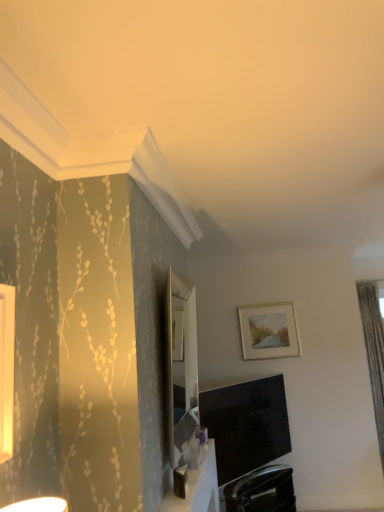
What do you see at coordinates (269, 331) in the screenshot?
I see `matte white picture frame at upper right` at bounding box center [269, 331].

This screenshot has height=512, width=384. What do you see at coordinates (246, 425) in the screenshot? I see `matte black tv at lower center` at bounding box center [246, 425].

Measure the distance between point (193, 360) and camera.

Point (193, 360) is 3.07 meters from camera.

Where is `gray textured curtain at right`? This screenshot has height=512, width=384. gray textured curtain at right is located at coordinates click(374, 352).

In the scene shown: Measure the distance between point (368,306) and camera.

Point (368,306) and camera are 4.21 meters apart.

This screenshot has width=384, height=512. Identify the location of black leather swivel chair at lower center. (262, 490).

Which object is more forward, black leather swivel chair at lower center or matte black tv at lower center?

black leather swivel chair at lower center is closer to the camera.

Can you confirm if black leather swivel chair at lower center is positioned to the right of matte black tv at lower center?

Yes.

From the image's perspective, between black leather swivel chair at lower center and matte black tv at lower center, which one is located above?

matte black tv at lower center appears higher in the image.

Would you consider matte black tv at lower center to be distant from black leather swivel chair at lower center?

Actually, matte black tv at lower center and black leather swivel chair at lower center are a little close together.

Would you say matte black tv at lower center is inside or outside black leather swivel chair at lower center?

matte black tv at lower center is spatially situated outside black leather swivel chair at lower center.

Considering the sizes of objects matte black tv at lower center and black leather swivel chair at lower center in the image provided, who is smaller, matte black tv at lower center or black leather swivel chair at lower center?

Smaller between the two is black leather swivel chair at lower center.

Between point (233, 473) and point (281, 507), which one is positioned in front?

Point (233, 473)

Which of these two, silver metallic mirror at center or gray textured curtain at right, stands shorter?

With less height is silver metallic mirror at center.

From a real-world perspective, relative to gray textured curtain at right, is silver metallic mirror at center vertically above or below?

From a real-world perspective, silver metallic mirror at center is physically above gray textured curtain at right.

What's the angular difference between silver metallic mirror at center and gray textured curtain at right's facing directions?

There is a 89.4-degree angle between the facing directions of silver metallic mirror at center and gray textured curtain at right.

Is silver metallic mirror at center closer to the viewer compared to gray textured curtain at right?

Yes, it is in front of gray textured curtain at right.

From a real-world perspective, is gray textured curtain at right located higher than black leather swivel chair at lower center?

Yes, from a real-world perspective, gray textured curtain at right is on top of black leather swivel chair at lower center.

Between point (362, 308) and point (228, 501), which one is positioned behind?

Point (362, 308)

Does gray textured curtain at right have a larger size compared to black leather swivel chair at lower center?

Yes, gray textured curtain at right is bigger than black leather swivel chair at lower center.

Can you tell me how much gray textured curtain at right and black leather swivel chair at lower center differ in facing direction?

The facing directions of gray textured curtain at right and black leather swivel chair at lower center are 55.4 degrees apart.

In terms of width, does silver metallic mirror at center look wider or thinner when compared to matte black tv at lower center?

silver metallic mirror at center is thinner than matte black tv at lower center.

Can you confirm if silver metallic mirror at center is positioned to the right of matte black tv at lower center?

In fact, silver metallic mirror at center is to the left of matte black tv at lower center.

Is silver metallic mirror at center far away from matte black tv at lower center?

No.

Are matte black tv at lower center and gray textured curtain at right located far from each other?

Absolutely, matte black tv at lower center is distant from gray textured curtain at right.

Where is `television in front of the gray textured curtain at right`? television in front of the gray textured curtain at right is located at coordinates (246, 425).

Is matte black tv at lower center not inside gray textured curtain at right?

Absolutely, matte black tv at lower center is external to gray textured curtain at right.

Which object is positioned more to the left, white glossy table at lower center or gray textured curtain at right?

white glossy table at lower center is more to the left.

Is white glossy table at lower center with gray textured curtain at right?

No.

Can you tell me how much white glossy table at lower center and gray textured curtain at right differ in facing direction?

The angular difference between white glossy table at lower center and gray textured curtain at right is 89.4 degrees.

Find the location of a particular element. swivel chair below the matte black tv at lower center (from a real-world perspective) is located at coordinates (262, 490).

The image size is (384, 512). In order to click on swivel chair in front of the matte black tv at lower center in this screenshot , I will do `click(262, 490)`.

When comparing their distances from black leather swivel chair at lower center, does silver metallic mirror at center or matte white picture frame at upper right seem further?

→ silver metallic mirror at center.

When comparing their distances from gray textured curtain at right, does matte white picture frame at upper right or black leather swivel chair at lower center seem further?

black leather swivel chair at lower center is positioned further to the anchor gray textured curtain at right.

Looking at the image, which one is located closer to white glossy table at lower center, matte black tv at lower center or matte white picture frame at upper right?

Based on the image, matte black tv at lower center appears to be nearer to white glossy table at lower center.

Which object lies nearer to the anchor point black leather swivel chair at lower center, matte black tv at lower center or matte white picture frame at upper right?

The object closer to black leather swivel chair at lower center is matte black tv at lower center.

Considering their positions, is matte black tv at lower center positioned closer to gray textured curtain at right than matte white picture frame at upper right?

matte white picture frame at upper right.

Looking at the image, which one is located closer to gray textured curtain at right, black leather swivel chair at lower center or matte black tv at lower center?

black leather swivel chair at lower center is closer to gray textured curtain at right.

Which object lies further to the anchor point gray textured curtain at right, white glossy table at lower center or matte white picture frame at upper right?

The object further to gray textured curtain at right is white glossy table at lower center.

When comparing their distances from white glossy table at lower center, does black leather swivel chair at lower center or matte black tv at lower center seem further?

black leather swivel chair at lower center.

Where is `swivel chair between white glossy table at lower center and matte black tv at lower center from front to back`? This screenshot has width=384, height=512. swivel chair between white glossy table at lower center and matte black tv at lower center from front to back is located at coordinates (262, 490).

At what (x,y) coordinates should I click in order to perform the action: click on mirror positioned between white glossy table at lower center and matte black tv at lower center from near to far. Please return your answer as a coordinate pair (x, y). The width and height of the screenshot is (384, 512). Looking at the image, I should click on (181, 364).

Locate an element on the screen. The width and height of the screenshot is (384, 512). picture frame between silver metallic mirror at center and gray textured curtain at right along the z-axis is located at coordinates (269, 331).

In order to click on swivel chair between white glossy table at lower center and gray textured curtain at right from front to back in this screenshot , I will do `click(262, 490)`.